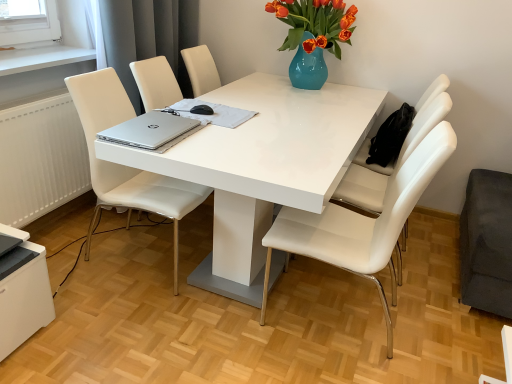
Identify the location of white glossy desktop at lower left. (22, 289).

The width and height of the screenshot is (512, 384). Describe the element at coordinates (392, 164) in the screenshot. I see `white leather chair at right, the third chair when ordered from left to right` at that location.

Locate an element on the screen. white glossy table at center is located at coordinates (262, 167).

Looking at this image, how much space does white leather chair at right, which ranks as the second chair in left-to-right order, occupy horizontally?

It is 24.59 inches.

Identify the location of white glossy desktop at lower left. This screenshot has width=512, height=384. (22, 289).

From the image's perspective, who appears lower, gray fabric curtain at upper left or silver metallic laptop at center?

silver metallic laptop at center, from the image's perspective.

Visually, is gray fabric curtain at upper left positioned to the left or to the right of silver metallic laptop at center?

gray fabric curtain at upper left is positioned on silver metallic laptop at center's left side.

Between gray fabric curtain at upper left and silver metallic laptop at center, which one has larger size?

gray fabric curtain at upper left is bigger.

Does point (153, 40) come behind point (199, 119)?

That is True.

Between white glossy desktop at lower left and white glossy table at center, which one appears on the right side from the viewer's perspective?

From the viewer's perspective, white glossy table at center appears more on the right side.

Looking at their sizes, would you say white glossy desktop at lower left is wider or thinner than white glossy table at center?

Considering their sizes, white glossy desktop at lower left looks slimmer than white glossy table at center.

Choose the correct answer: Is white glossy desktop at lower left inside white glossy table at center or outside it?

white glossy desktop at lower left is outside white glossy table at center.

From the image's perspective, is white glossy desktop at lower left beneath white glossy table at center?

Yes.

Does silver metallic laptop at center turn towards white leather chair at right, the second chair when ordered from right to left?

No, silver metallic laptop at center is not facing towards white leather chair at right, the second chair when ordered from right to left.

Between silver metallic laptop at center and white leather chair at right, the second chair when ordered from right to left, which one has more height?

Standing taller between the two is white leather chair at right, the second chair when ordered from right to left.

Who is smaller, silver metallic laptop at center or white leather chair at right, the second chair when ordered from right to left?

silver metallic laptop at center.

From a real-world perspective, count 3rd chairs downward from the silver metallic laptop at center and point to it. Please provide its 2D coordinates.

[(362, 223)]

From a real-world perspective, which object rests below the other?

From a 3D spatial view, silver metallic laptop at center is below.

Does silver metallic laptop at center appear on the right side of silver metallic laptop at center?

Yes, silver metallic laptop at center is to the right of silver metallic laptop at center.

Considering the sizes of silver metallic laptop at center and silver metallic laptop at center in the image, is silver metallic laptop at center taller or shorter than silver metallic laptop at center?

Considering their sizes, silver metallic laptop at center has less height than silver metallic laptop at center.

In terms of width, does silver metallic laptop at center look wider or thinner when compared to silver metallic laptop at center?

silver metallic laptop at center is thinner than silver metallic laptop at center.

Could you tell me if white leather chair at right, the third chair when ordered from left to right, is turned towards white glossy table at center?

Yes, white leather chair at right, the third chair when ordered from left to right, is oriented towards white glossy table at center.

Does point (414, 146) appear closer or farther from the camera than point (273, 102)?

Point (414, 146) is positioned closer to the camera compared to point (273, 102).

Is white leather chair at right, acting as the first chair starting from the right, not close to white glossy table at center?

No, there isn't a large distance between white leather chair at right, acting as the first chair starting from the right, and white glossy table at center.

Which object is wider, silver metallic laptop at center or white glossy table at center?

white glossy table at center.

In the scene shown: Is silver metallic laptop at center looking in the opposite direction of white glossy table at center?

Yes, silver metallic laptop at center is facing away from white glossy table at center.

Based on their sizes in the image, would you say silver metallic laptop at center is bigger or smaller than white glossy table at center?

Considering their sizes, silver metallic laptop at center takes up less space than white glossy table at center.

Is silver metallic laptop at center next to white glossy table at center and touching it?

silver metallic laptop at center is not next to white glossy table at center, and they're not touching.

Considering the relative sizes of white leather chair at right, which ranks as the second chair in left-to-right order, and white leather chair at right, the third chair when ordered from left to right, in the image provided, is white leather chair at right, which ranks as the second chair in left-to-right order, bigger than white leather chair at right, the third chair when ordered from left to right,?

Correct, white leather chair at right, which ranks as the second chair in left-to-right order, is larger in size than white leather chair at right, the third chair when ordered from left to right.

The image size is (512, 384). I want to click on chair that is the 2nd one above the white leather chair at right, the second chair when ordered from right to left (from a real-world perspective), so click(x=392, y=164).

Considering the relative positions of white leather chair at right, the second chair when ordered from right to left, and white leather chair at right, the third chair when ordered from left to right, in the image provided, is white leather chair at right, the second chair when ordered from right to left, to the left of white leather chair at right, the third chair when ordered from left to right, from the viewer's perspective?

Indeed, white leather chair at right, the second chair when ordered from right to left, is positioned on the left side of white leather chair at right, the third chair when ordered from left to right.

In the scene shown: From the image's perspective, who appears lower, white leather chair at right, the second chair when ordered from right to left, or white leather chair at right, the third chair when ordered from left to right?

white leather chair at right, the second chair when ordered from right to left.

Find the location of a particular element. notebook located on the right of gray fabric curtain at upper left is located at coordinates (213, 113).

In order to click on table above the white glossy desktop at lower left (from a real-world perspective) in this screenshot , I will do `click(262, 167)`.

Looking at this image, when comparing their distances from white leather chair at center, the third chair viewed from the right, does white glossy desktop at lower left or white leather chair at right, which ranks as the second chair in left-to-right order, seem further?

Among the two, white leather chair at right, which ranks as the second chair in left-to-right order, is located further to white leather chair at center, the third chair viewed from the right.

Looking at the image, which one is located closer to white leather chair at center, the third chair viewed from the right, gray fabric curtain at upper left or white glossy table at center?

The object closer to white leather chair at center, the third chair viewed from the right, is white glossy table at center.

Which object lies nearer to the anchor point gray fabric curtain at upper left, white glossy desktop at lower left or white glossy table at center?

white glossy table at center.

Looking at the image, which one is located closer to silver metallic laptop at center, silver metallic laptop at center or gray fabric curtain at upper left?

The object closer to silver metallic laptop at center is silver metallic laptop at center.

Considering their positions, is gray fabric curtain at upper left positioned further to white leather chair at right, which ranks as the second chair in left-to-right order, than white glossy desktop at lower left?

gray fabric curtain at upper left.

Considering their positions, is white leather chair at center, the third chair viewed from the right, positioned closer to gray fabric curtain at upper left than white leather chair at right, acting as the first chair starting from the right?

white leather chair at center, the third chair viewed from the right, lies closer to gray fabric curtain at upper left than the other object.

Estimate the real-world distances between objects in this image. Which object is closer to white leather chair at center, which is the 1th chair from left to right, silver metallic laptop at center or white glossy table at center?

silver metallic laptop at center is closer to white leather chair at center, which is the 1th chair from left to right.

Which object lies further to the anchor point white leather chair at right, the second chair when ordered from right to left, silver metallic laptop at center or white leather chair at center, the third chair viewed from the right?

The object further to white leather chair at right, the second chair when ordered from right to left, is white leather chair at center, the third chair viewed from the right.

This screenshot has height=384, width=512. In order to click on curtain situated between white glossy desktop at lower left and white leather chair at right, which ranks as the second chair in left-to-right order, from left to right in this screenshot , I will do pos(148,37).

Identify the location of chair between white glossy desktop at lower left and silver metallic laptop at center from left to right. (126, 166).

Locate an element on the screen. The width and height of the screenshot is (512, 384). laptop between gray fabric curtain at upper left and white leather chair at center, the third chair viewed from the right, from top to bottom is located at coordinates (151, 130).

This screenshot has height=384, width=512. What are the coordinates of `notebook between silver metallic laptop at center and white leather chair at right, the second chair when ordered from right to left, in the horizontal direction` in the screenshot? It's located at (213, 113).